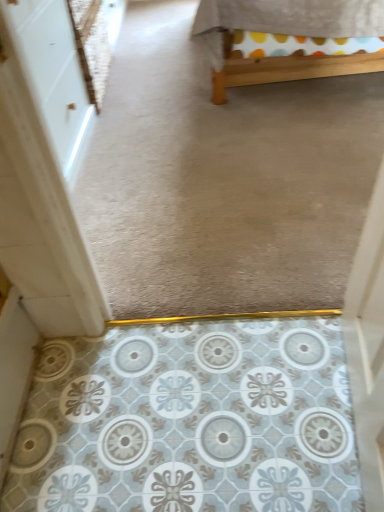
Describe the element at coordinates (288, 39) in the screenshot. I see `wooden bed frame at upper center` at that location.

Locate an element on the screen. This screenshot has height=512, width=384. wooden bed frame at upper center is located at coordinates (288, 39).

The width and height of the screenshot is (384, 512). I want to click on white glossy door at left, so [x=53, y=72].

The image size is (384, 512). What do you see at coordinates (53, 72) in the screenshot? I see `white glossy door at left` at bounding box center [53, 72].

Measure the distance between point (77, 135) and camera.

Point (77, 135) is 6.60 feet away from camera.

The height and width of the screenshot is (512, 384). In order to click on wooden bed frame at upper center in this screenshot , I will do `click(288, 39)`.

Can you confirm if wooden bed frame at upper center is positioned to the right of white glossy door at left?

Yes, wooden bed frame at upper center is to the right of white glossy door at left.

Which object is closer to the camera, wooden bed frame at upper center or white glossy door at left?

white glossy door at left is more forward.

Does point (204, 14) appear closer or farther from the camera than point (54, 4)?

Point (204, 14) appears to be farther away from the viewer than point (54, 4).

From the image's perspective, is wooden bed frame at upper center on white glossy door at left?

Yes, from the image's perspective, wooden bed frame at upper center is above white glossy door at left.

Looking at this image, from a real-world perspective, is wooden bed frame at upper center under white glossy door at left?

Correct, in the physical world, wooden bed frame at upper center is lower than white glossy door at left.

Is wooden bed frame at upper center wider or thinner than white glossy door at left?

In the image, wooden bed frame at upper center appears to be wider than white glossy door at left.

Is wooden bed frame at upper center shorter than white glossy door at left?

Yes, wooden bed frame at upper center is shorter than white glossy door at left.

From the picture: Is wooden bed frame at upper center bigger or smaller than white glossy door at left?

Clearly, wooden bed frame at upper center is larger in size than white glossy door at left.

Is white glossy door at left located within wooden bed frame at upper center?

Actually, white glossy door at left is outside wooden bed frame at upper center.

Can you see wooden bed frame at upper center touching white glossy door at left?

No, wooden bed frame at upper center is not next to white glossy door at left.

Is wooden bed frame at upper center turned away from white glossy door at left?

No, wooden bed frame at upper center's orientation is not away from white glossy door at left.

How many degrees apart are the facing directions of wooden bed frame at upper center and white glossy door at left?

180 degrees separate the facing orientations of wooden bed frame at upper center and white glossy door at left.

How much distance is there between wooden bed frame at upper center and white glossy door at left?

wooden bed frame at upper center and white glossy door at left are 92.72 centimeters apart.

The width and height of the screenshot is (384, 512). What are the coordinates of `furniture located on the right of white glossy door at left` in the screenshot? It's located at (288, 39).

Which is more to the right, white glossy door at left or wooden bed frame at upper center?

Positioned to the right is wooden bed frame at upper center.

Who is more distant, white glossy door at left or wooden bed frame at upper center?

wooden bed frame at upper center is further away from the camera.

Considering the positions of points (56, 94) and (323, 27), is point (56, 94) closer to camera compared to point (323, 27)?

That is True.

From the image's perspective, is white glossy door at left above or below wooden bed frame at upper center?

From the image's perspective, white glossy door at left appears below wooden bed frame at upper center.

From a real-world perspective, relative to wooden bed frame at upper center, is white glossy door at left vertically above or below?

In terms of real-world spatial position, white glossy door at left is above wooden bed frame at upper center.

Considering the relative sizes of white glossy door at left and wooden bed frame at upper center in the image provided, is white glossy door at left thinner than wooden bed frame at upper center?

Correct, the width of white glossy door at left is less than that of wooden bed frame at upper center.

Looking at this image, is white glossy door at left shorter than wooden bed frame at upper center?

In fact, white glossy door at left may be taller than wooden bed frame at upper center.

Which of these two, white glossy door at left or wooden bed frame at upper center, is bigger?

wooden bed frame at upper center.

Is white glossy door at left inside or outside of wooden bed frame at upper center?

white glossy door at left is spatially situated outside wooden bed frame at upper center.

Are white glossy door at left and wooden bed frame at upper center beside each other?

They are not placed beside each other.

Is white glossy door at left oriented towards wooden bed frame at upper center?

No, white glossy door at left is not oriented towards wooden bed frame at upper center.

How distant is white glossy door at left from wooden bed frame at upper center?

They are 92.72 centimeters apart.

You are a GUI agent. You are given a task and a screenshot of the screen. Output one action in this format:
    pyautogui.click(x=<x>, y=<y>)
    Task: Click on the screen door that is below the wooden bed frame at upper center (from the image's perspective)
    This screenshot has width=384, height=512.
    Given the screenshot: What is the action you would take?
    pyautogui.click(x=53, y=72)

At what (x,y) coordinates should I click in order to perform the action: click on furniture on the right side of white glossy door at left. Please return your answer as a coordinate pair (x, y). The image size is (384, 512). Looking at the image, I should click on (288, 39).

This screenshot has height=512, width=384. Identify the location of furniture behind the white glossy door at left. (288, 39).